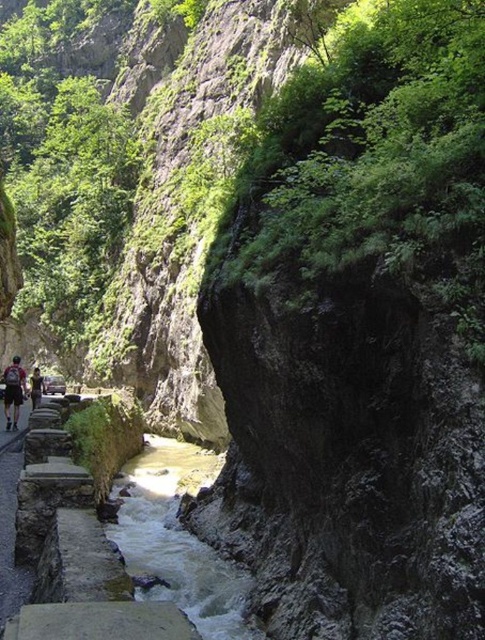
Question: Does dark gray backpack at left appear on the right side of dark blue jeans at left?

Choices:
 (A) no
 (B) yes

Answer: (A)

Question: Can you confirm if dark gray backpack at left is positioned above dark blue jeans at left?

Choices:
 (A) yes
 (B) no

Answer: (A)

Question: Among these objects, which one is farthest from the camera?

Choices:
 (A) dark gray backpack at left
 (B) dark blue jeans at left

Answer: (B)

Question: Which point appears farthest from the camera in this image?

Choices:
 (A) (16, 416)
 (B) (31, 396)

Answer: (B)

Question: Which point appears farthest from the camera in this image?

Choices:
 (A) (13, 364)
 (B) (35, 387)

Answer: (A)

Question: Is dark gray backpack at left smaller than dark blue jeans at left?

Choices:
 (A) yes
 (B) no

Answer: (B)